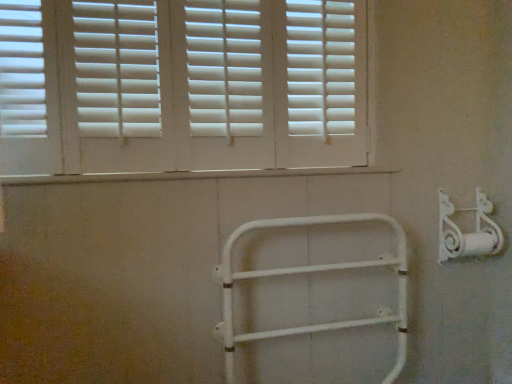
Question: From the image's perspective, is white matte bracket at right located beneath white matte shutters at upper center?

Choices:
 (A) yes
 (B) no

Answer: (A)

Question: Is white matte bracket at right oriented away from white matte shutters at upper center?

Choices:
 (A) no
 (B) yes

Answer: (A)

Question: Is white matte bracket at right at the right side of white matte shutters at upper center?

Choices:
 (A) yes
 (B) no

Answer: (A)

Question: Is white matte bracket at right to the left of white matte shutters at upper center from the viewer's perspective?

Choices:
 (A) yes
 (B) no

Answer: (B)

Question: Is white matte bracket at right aimed at white matte shutters at upper center?

Choices:
 (A) yes
 (B) no

Answer: (B)

Question: Can you confirm if white matte bracket at right is smaller than white matte shutters at upper center?

Choices:
 (A) yes
 (B) no

Answer: (A)

Question: Does white matte metal rail at center have a lesser width compared to white matte bracket at right?

Choices:
 (A) no
 (B) yes

Answer: (B)

Question: Is white matte metal rail at center positioned beyond the bounds of white matte bracket at right?

Choices:
 (A) yes
 (B) no

Answer: (A)

Question: From the image's perspective, is white matte metal rail at center on top of white matte bracket at right?

Choices:
 (A) no
 (B) yes

Answer: (A)

Question: Could you tell me if white matte metal rail at center is turned towards white matte bracket at right?

Choices:
 (A) no
 (B) yes

Answer: (A)

Question: Is white matte metal rail at center far from white matte bracket at right?

Choices:
 (A) yes
 (B) no

Answer: (B)

Question: From a real-world perspective, is white matte metal rail at center positioned under white matte bracket at right based on gravity?

Choices:
 (A) no
 (B) yes

Answer: (B)

Question: From the image's perspective, does white matte shutters at upper center appear lower than white matte bracket at right?

Choices:
 (A) yes
 (B) no

Answer: (B)